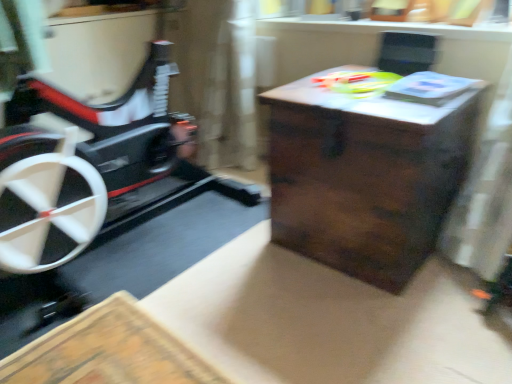
At what (x,y) coordinates should I click in order to perform the action: click on vacant space in front of translucent plastic toy at upper center. Please return your answer as a coordinate pair (x, y). This screenshot has width=512, height=384. Looking at the image, I should click on (380, 105).